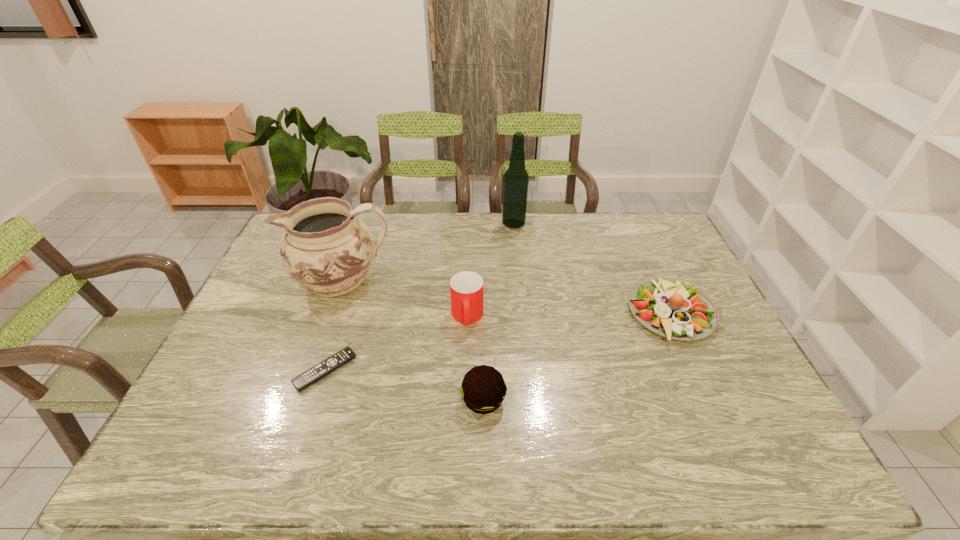
The image size is (960, 540). Identify the location of vacant space located on the side of the cup with the handle. (465, 409).

In order to click on free region located on the left of the patty in this screenshot , I will do `click(351, 400)`.

In order to click on blank space located on the back of the second shortest object in this screenshot , I will do `click(630, 224)`.

In order to click on free location located on the right of the remote control in this screenshot , I will do `click(475, 370)`.

Find the location of a particular element. object at the far edge is located at coordinates (515, 187).

Where is `object at the left edge`? object at the left edge is located at coordinates (326, 246).

You are a GUI agent. You are given a task and a screenshot of the screen. Output one action in this format:
    pyautogui.click(x=<x>, y=<y>)
    Task: Click on the object present at the right edge
    
    Given the screenshot: What is the action you would take?
    pyautogui.click(x=670, y=309)

This screenshot has height=540, width=960. Find the location of `free space at the far edge`. free space at the far edge is located at coordinates click(x=555, y=234).

Locate an element on the screen. vacant space at the near edge of the desktop is located at coordinates [x=720, y=453].

In order to click on vacant space at the left edge of the desktop in this screenshot , I will do `click(258, 284)`.